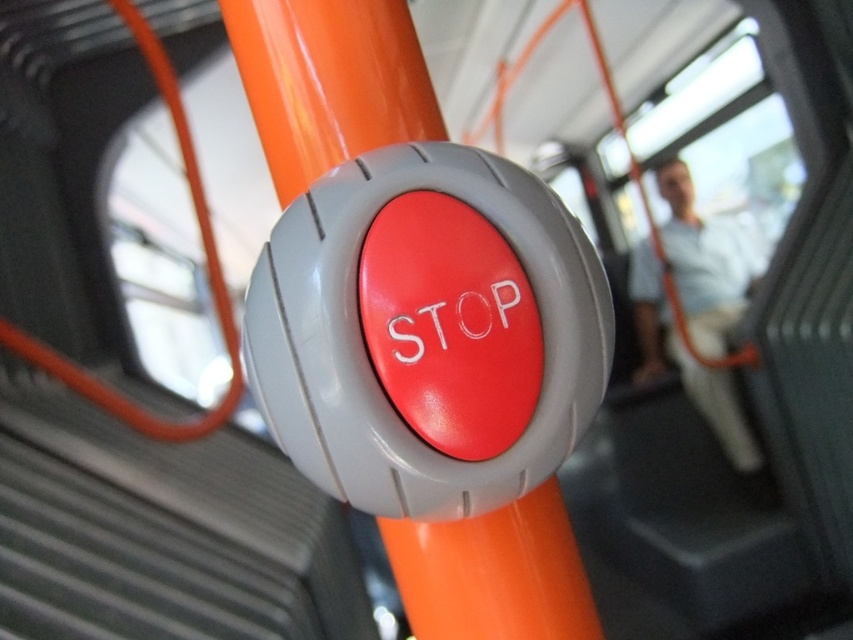
You are a passenger on a bus and need to locate the emergency stop button. You see the matte orange pole at center and the white fabric coach at upper center. Which object is smaller in size?

The matte orange pole at center occupies less space than the white fabric coach at upper center, so the matte orange pole at center is smaller in size.

You are a passenger on a bus and need to reach the matte orange pole at center to grab your bag. There is a white fabric coach at upper center nearby. Which object is narrower, allowing you to pass through more easily?

The matte orange pole at center is narrower than the white fabric coach at upper center, so you can pass through more easily around the matte orange pole at center.